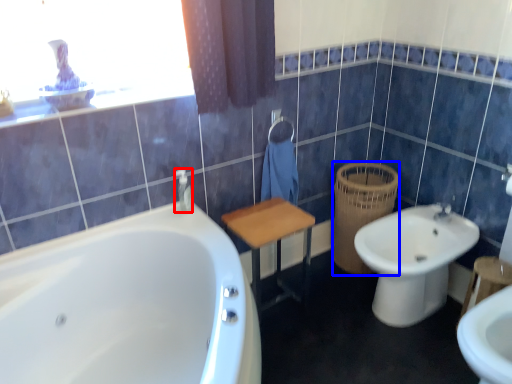
Question: Which object appears farthest to the camera in this image, toiletry (highlighted by a red box) or basket (highlighted by a blue box)?

Choices:
 (A) toiletry
 (B) basket

Answer: (B)